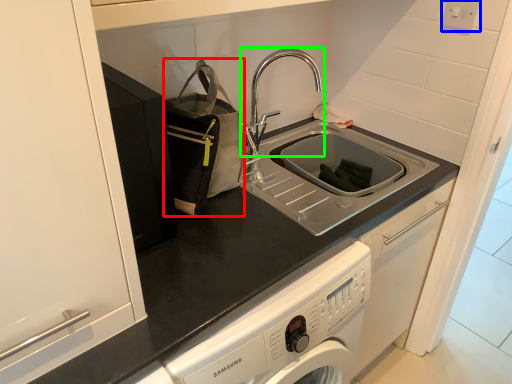
Question: Which object is positioned farthest from bag (highlighted by a red box)? Select from electric outlet (highlighted by a blue box) and tap (highlighted by a green box).

Choices:
 (A) electric outlet
 (B) tap

Answer: (A)